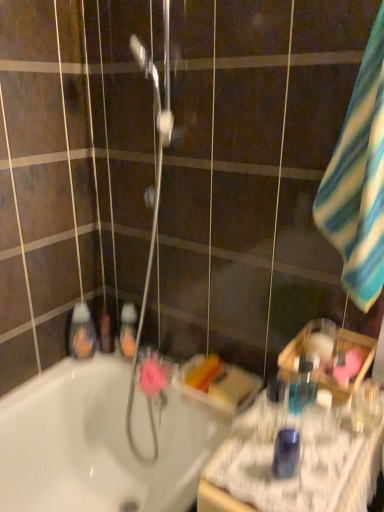
Where is `vacant space in front of translucent plastic mouthwash at right, which ranks as the 2th mouthwash in right-to-left order`? vacant space in front of translucent plastic mouthwash at right, which ranks as the 2th mouthwash in right-to-left order is located at coordinates (310, 466).